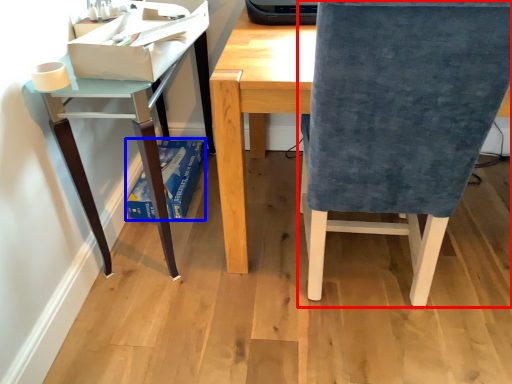
Question: Which point is further to the camera, chair (highlighted by a red box) or paperback book (highlighted by a blue box)?

Choices:
 (A) chair
 (B) paperback book

Answer: (B)